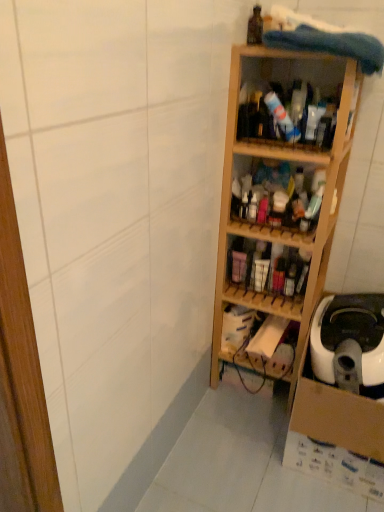
Question: Is wooden shelf at center, the fifth shelf positioned from the bottom, beside light wood shelf at center, the third shelf viewed from the top?

Choices:
 (A) no
 (B) yes

Answer: (A)

Question: Is wooden shelf at center, which is the 1th shelf from top to bottom, facing towards light wood shelf at center, the third shelf viewed from the top?

Choices:
 (A) yes
 (B) no

Answer: (A)

Question: Considering the relative sizes of wooden shelf at center, the fifth shelf positioned from the bottom, and light wood shelf at center, which ranks as the third shelf in bottom-to-top order, in the image provided, is wooden shelf at center, the fifth shelf positioned from the bottom, bigger than light wood shelf at center, which ranks as the third shelf in bottom-to-top order,?

Choices:
 (A) no
 (B) yes

Answer: (A)

Question: From a real-world perspective, is wooden shelf at center, which is the 1th shelf from top to bottom, under light wood shelf at center, which ranks as the third shelf in bottom-to-top order?

Choices:
 (A) no
 (B) yes

Answer: (A)

Question: From the image's perspective, would you say wooden shelf at center, which is the 1th shelf from top to bottom, is shown under light wood shelf at center, which ranks as the third shelf in bottom-to-top order?

Choices:
 (A) no
 (B) yes

Answer: (A)

Question: From the image's perspective, relative to wooden shelf at center, marked as the 1th shelf in a bottom-to-top arrangement, is wooden shelves at center, acting as the fourth shelf starting from the bottom, above or below?

Choices:
 (A) above
 (B) below

Answer: (A)

Question: Considering the relative positions of wooden shelves at center, acting as the fourth shelf starting from the bottom, and wooden shelf at center, which is the fifth shelf from top to bottom, in the image provided, is wooden shelves at center, acting as the fourth shelf starting from the bottom, to the left or to the right of wooden shelf at center, which is the fifth shelf from top to bottom,?

Choices:
 (A) left
 (B) right

Answer: (A)

Question: In terms of height, does wooden shelves at center, the second shelf viewed from the top, look taller or shorter compared to wooden shelf at center, marked as the 1th shelf in a bottom-to-top arrangement?

Choices:
 (A) short
 (B) tall

Answer: (B)

Question: Considering the positions of wooden shelves at center, the second shelf viewed from the top, and wooden shelf at center, which is the fifth shelf from top to bottom, in the image, is wooden shelves at center, the second shelf viewed from the top, bigger or smaller than wooden shelf at center, which is the fifth shelf from top to bottom,?

Choices:
 (A) big
 (B) small

Answer: (A)

Question: From a real-world perspective, is wooden shelf at center, the fifth shelf positioned from the bottom, physically located above or below wooden shelves at center, which ranks as the 2th shelf in bottom-to-top order?

Choices:
 (A) below
 (B) above

Answer: (B)

Question: Is wooden shelf at center, the fifth shelf positioned from the bottom, taller or shorter than wooden shelves at center, the fourth shelf positioned from the top?

Choices:
 (A) short
 (B) tall

Answer: (B)

Question: Considering the positions of wooden shelf at center, which is the 1th shelf from top to bottom, and wooden shelves at center, which ranks as the 2th shelf in bottom-to-top order, in the image, is wooden shelf at center, which is the 1th shelf from top to bottom, wider or thinner than wooden shelves at center, which ranks as the 2th shelf in bottom-to-top order,?

Choices:
 (A) wide
 (B) thin

Answer: (A)

Question: Relative to wooden shelves at center, which ranks as the 2th shelf in bottom-to-top order, is wooden shelf at center, which is the 1th shelf from top to bottom, in front or behind?

Choices:
 (A) front
 (B) behind

Answer: (A)

Question: Is light wood shelf at center, the third shelf viewed from the top, in front of or behind wooden shelves at center, acting as the fourth shelf starting from the bottom, in the image?

Choices:
 (A) front
 (B) behind

Answer: (A)

Question: Is light wood shelf at center, which ranks as the third shelf in bottom-to-top order, taller or shorter than wooden shelves at center, acting as the fourth shelf starting from the bottom?

Choices:
 (A) tall
 (B) short

Answer: (A)